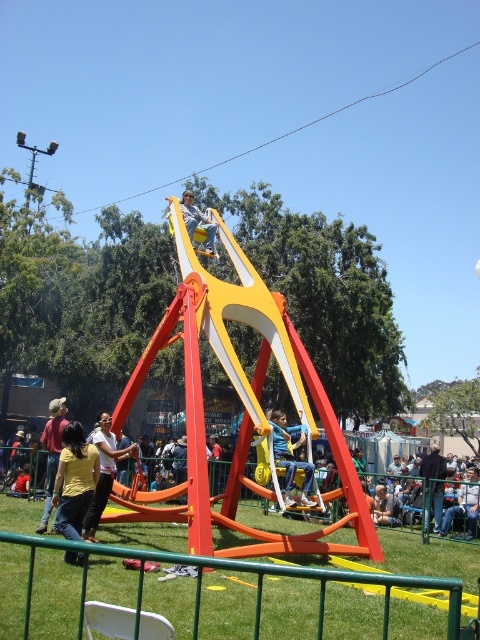
You are at the fair and see the yellow matte swing at center and the yellow fabric shirt at center. Which object is taller?

The yellow matte swing at center is taller than the yellow fabric shirt at center.

You are standing at the entrance of the fair and see the yellow matte swing at center and the yellow fabric shirt at center. Which object is positioned to the right side from your viewpoint?

The yellow matte swing at center is to the right of the yellow fabric shirt at center, so the yellow matte swing at center is positioned to the right side from your viewpoint.

You are a photographer at the fair and want to take a photo of both the yellow shirt at lower left and the yellow fabric shirt at center. Which shirt should you focus on first if you want to capture the one closer to the front?

The yellow shirt at lower left is shorter than the yellow fabric shirt at center, so the yellow shirt at lower left is closer to the front. Focus on the yellow shirt at lower left first.